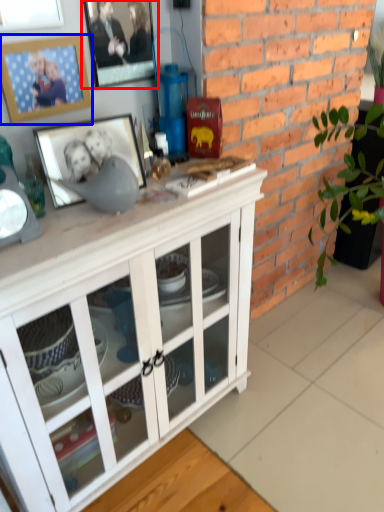
Question: Which of the following is the farthest to the observer, picture frame (highlighted by a red box) or picture frame (highlighted by a blue box)?

Choices:
 (A) picture frame
 (B) picture frame

Answer: (A)